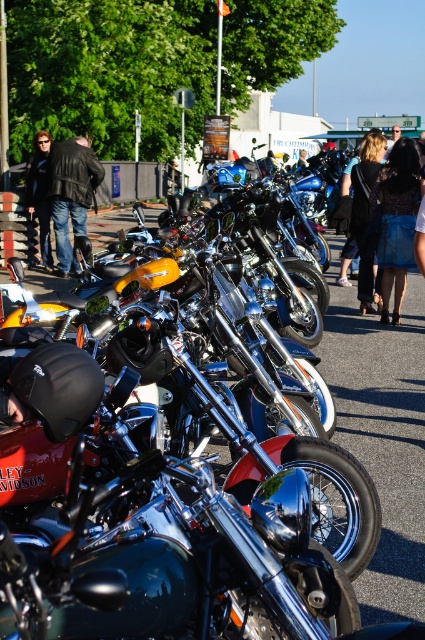
Who is more forward, (x=96, y=177) or (x=36, y=184)?

Point (x=36, y=184)

Which of these two, leather jacket at left or matte black jacket at left, stands shorter?

matte black jacket at left is shorter.

Between point (53, 205) and point (48, 136), which one is positioned behind?

The point (48, 136) is behind.

Where is `leather jacket at left`? The image size is (425, 640). leather jacket at left is located at coordinates (70, 193).

Is blue fabric bag at center smaller than dark brown leather jacket at center?

Actually, blue fabric bag at center might be larger than dark brown leather jacket at center.

Can you confirm if blue fabric bag at center is positioned below dark brown leather jacket at center?

Yes.

Locate an element on the screen. The image size is (425, 640). blue fabric bag at center is located at coordinates (396, 220).

This screenshot has height=640, width=425. Find the location of `blue fabric bag at center`. blue fabric bag at center is located at coordinates (396, 220).

This screenshot has height=640, width=425. What do you see at coordinates (396, 220) in the screenshot? I see `blue fabric bag at center` at bounding box center [396, 220].

In the scene shown: Who is more forward, (408,186) or (87,193)?

Point (408,186) is more forward.

Is point (416, 204) positioned after point (68, 154)?

No, it is in front of (68, 154).

In order to click on blue fabric bag at center in this screenshot , I will do `click(396, 220)`.